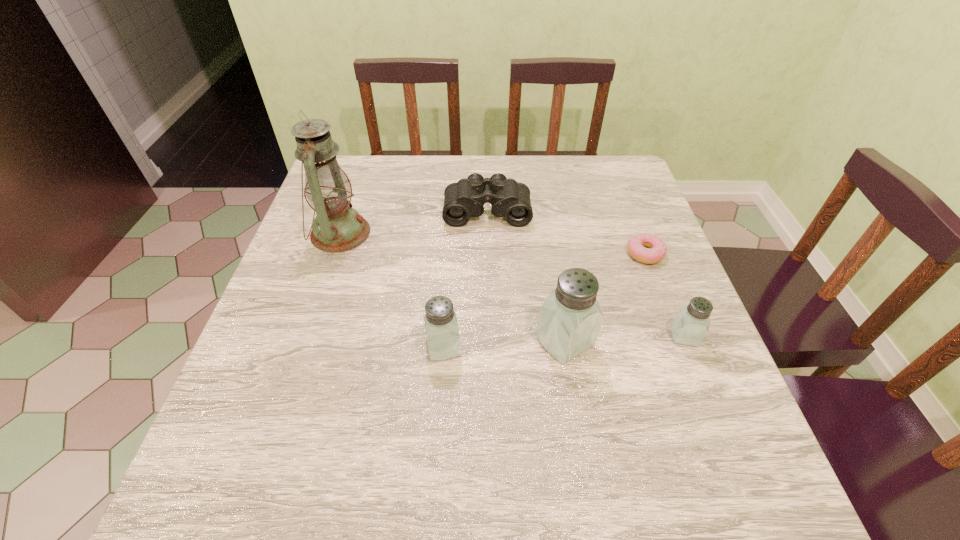
With all saltshakers evenly spaced, where should an extra saltshaker be placed on the left to continue the pattern? Please point out a vacant space. Please provide its 2D coordinates. Your answer should be formatted as a tuple, i.e. [(x, y)], where the tuple contains the x and y coordinates of a point satisfying the conditions above.

[(319, 352)]